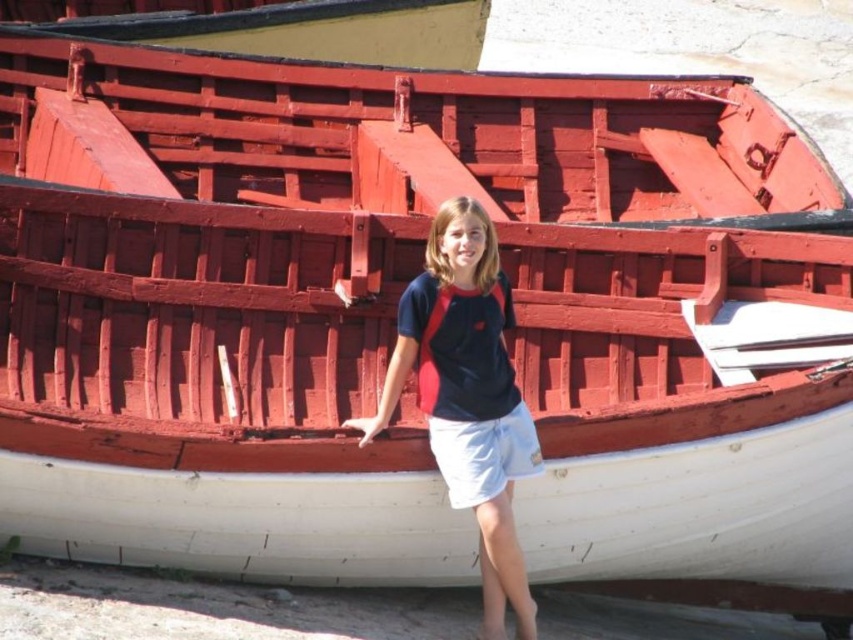
In the scene shown: You are a photographer trying to capture the smooth yellow wood boat at upper center. However, the matte black shirt at center is blocking your view. Can you see the boat through the shirt?

The matte black shirt at center is in front of the smooth yellow wood boat at upper center, so the boat is blocked and cannot be seen through the shirt.

In the scene shown: You are a photographer trying to capture the scene of the person beside the boat. The camera you are using has a focal length of 50mm and an aperture of f2.8. To ensure the person in the matte black shirt at center is in focus, where should you adjust the focus point on the camera? Please provide the coordinates in the format of x,y.

The focus point should be set to [468,396] to ensure the matte black shirt at center is in focus.